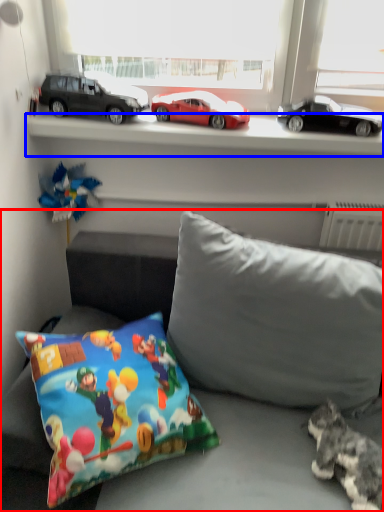
Question: Which object appears farthest to the camera in this image, studio couch (highlighted by a red box) or window sill (highlighted by a blue box)?

Choices:
 (A) studio couch
 (B) window sill

Answer: (B)